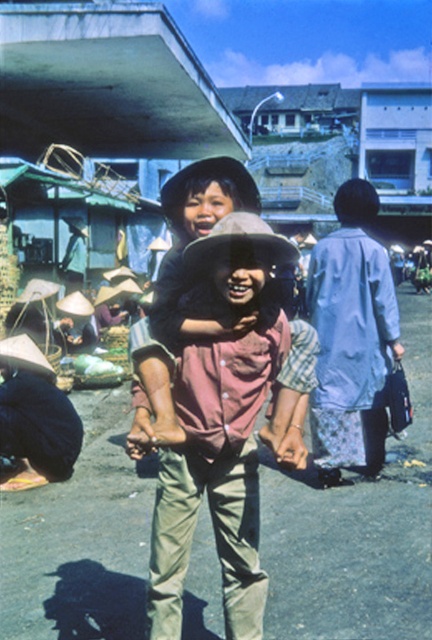
You are standing at the market entrance and see two points in the scene. The first point is at coordinates point (253, 596) and the second is at point (400, 346). Which point is closer to you?

Point (253, 596) is in front of point (400, 346), so it is closer to you.